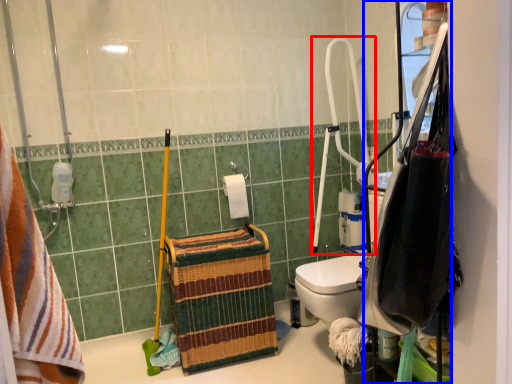
Question: Which object appears farthest to the camera in this image, shower (highlighted by a red box) or cabinetry (highlighted by a blue box)?

Choices:
 (A) shower
 (B) cabinetry

Answer: (A)